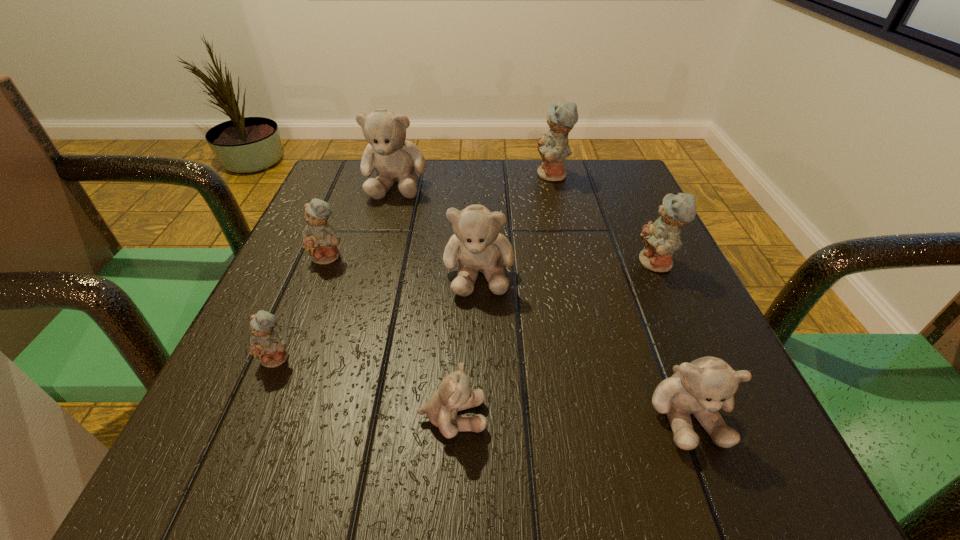
Choose which object is the third nearest neighbor to the sixth farthest object. Please provide its 2D coordinates. Your answer should be formatted as a tuple, i.e. [(x, y)], where the tuple contains the x and y coordinates of a point satisfying the conditions above.

[(477, 244)]

This screenshot has height=540, width=960. I want to click on the third closest object to the biggest gray teddy bear, so click(553, 148).

Where is `teddy bear identified as the second closest to the smallest gray teddy bear`? teddy bear identified as the second closest to the smallest gray teddy bear is located at coordinates (267, 346).

This screenshot has width=960, height=540. Identify the location of teddy bear that is the second closest to the rightmost gray teddy bear. (454, 394).

The width and height of the screenshot is (960, 540). Find the location of `the second closest blue teddy bear relative to the third biggest gray teddy bear`. the second closest blue teddy bear relative to the third biggest gray teddy bear is located at coordinates (267, 346).

The width and height of the screenshot is (960, 540). I want to click on blue teddy bear identified as the closest to the farthest blue teddy bear, so coord(660,239).

Identify which gray teddy bear is the second nearest to the smallest gray teddy bear. Please provide its 2D coordinates. Your answer should be formatted as a tuple, i.e. [(x, y)], where the tuple contains the x and y coordinates of a point satisfying the conditions above.

[(702, 387)]

Select which gray teddy bear is the closest to the sixth object from left to right. Please provide its 2D coordinates. Your answer should be formatted as a tuple, i.e. [(x, y)], where the tuple contains the x and y coordinates of a point satisfying the conditions above.

[(477, 244)]

At what (x,y) coordinates should I click in order to perform the action: click on free point that satisfies the following two spatial constraints: 1. on the front-facing side of the third object from right to left; 2. on the face of the third smallest gray teddy bear. Please return your answer as a coordinate pair (x, y). Looking at the image, I should click on (576, 273).

I want to click on vacant space that satisfies the following two spatial constraints: 1. on the front-facing side of the rightmost blue teddy bear; 2. on the face of the rightmost gray teddy bear, so click(725, 414).